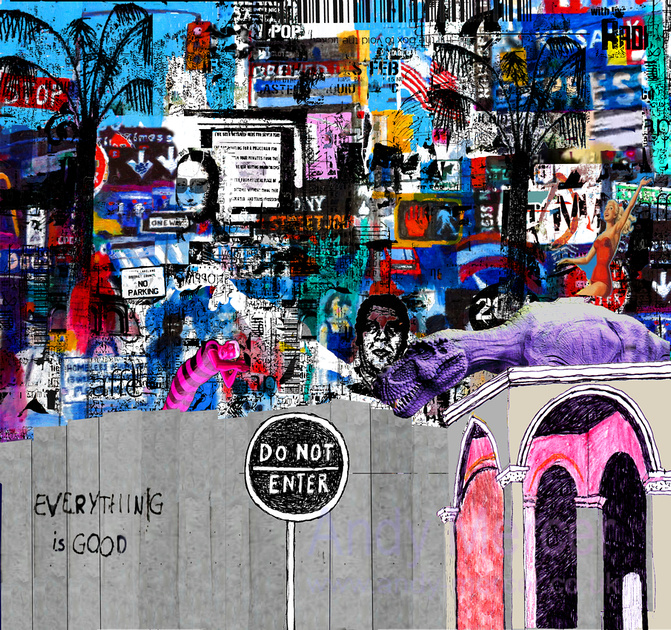
In order to click on mural in this screenshot , I will do `click(382, 287)`.